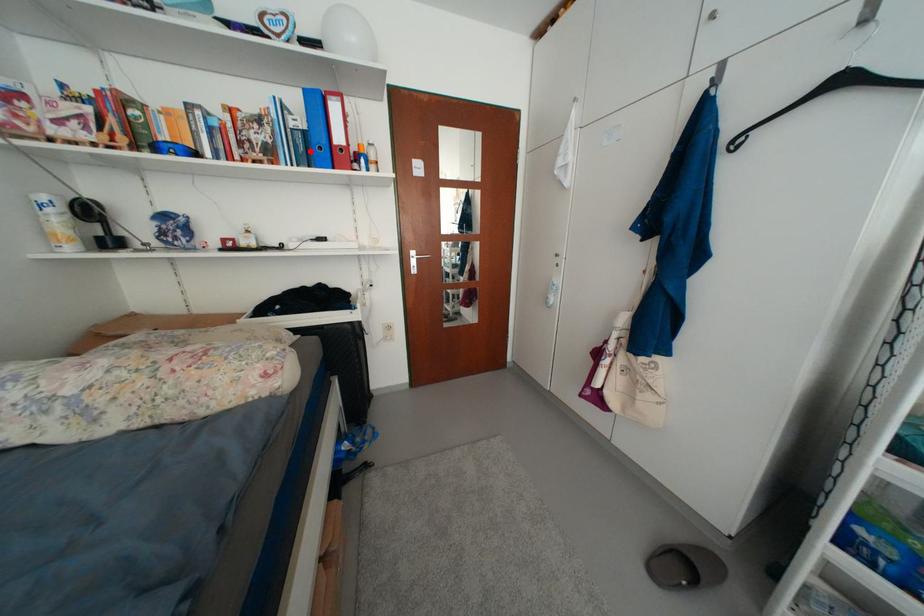
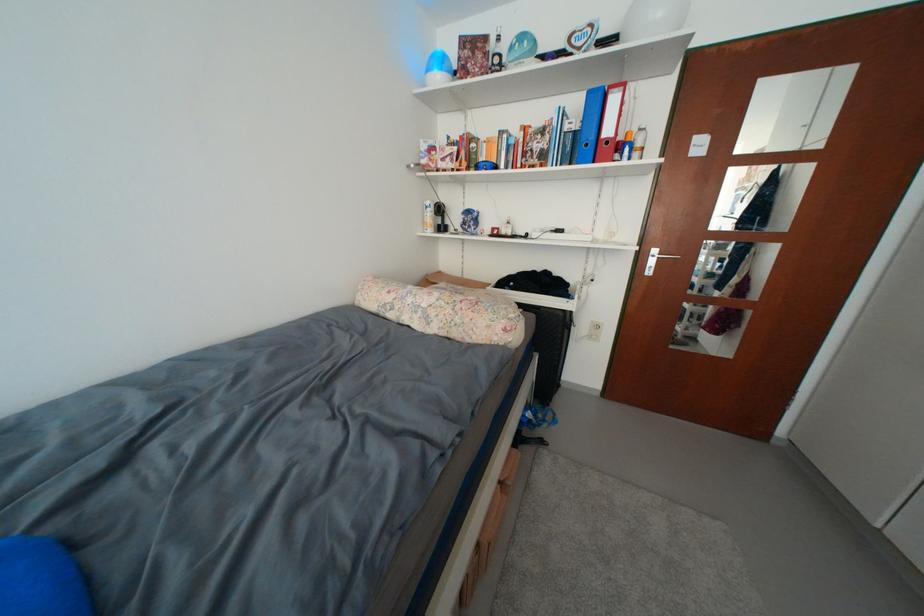
Find the pixel in the second image that matches the highlighted location in the first image.

(578, 151)